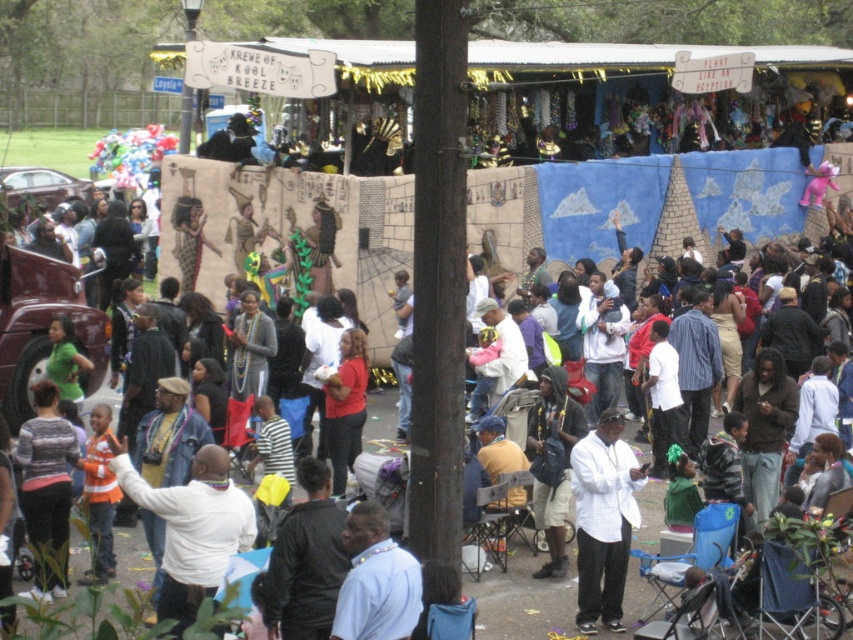
Which of these two, white matte shirt at center or white shirt at center, stands shorter?

With less height is white shirt at center.

Where is `white matte shirt at center`? The width and height of the screenshot is (853, 640). white matte shirt at center is located at coordinates (602, 520).